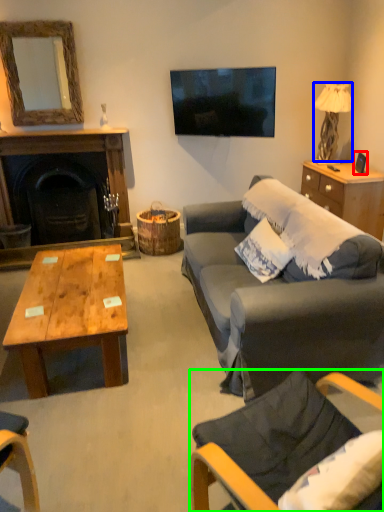
Question: Which object is positioned closest to picture frame (highlighted by a red box)? Select from lamp (highlighted by a blue box) and chair (highlighted by a green box).

Choices:
 (A) lamp
 (B) chair

Answer: (A)